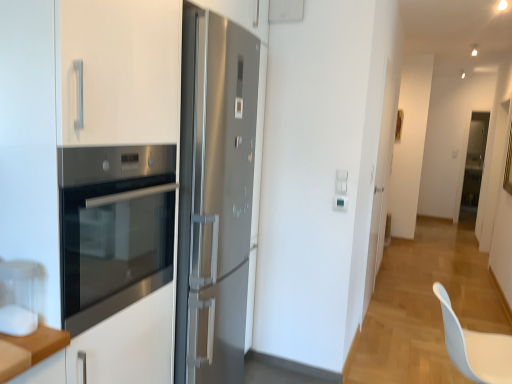
Question: Can you confirm if transparent glass door at center is bigger than stainless steel oven at left?

Choices:
 (A) no
 (B) yes

Answer: (A)

Question: From the image's perspective, is transparent glass door at center under stainless steel oven at left?

Choices:
 (A) no
 (B) yes

Answer: (A)

Question: Is transparent glass door at center oriented away from stainless steel oven at left?

Choices:
 (A) no
 (B) yes

Answer: (A)

Question: Considering the relative sizes of transparent glass door at center and stainless steel oven at left in the image provided, is transparent glass door at center wider than stainless steel oven at left?

Choices:
 (A) yes
 (B) no

Answer: (B)

Question: Considering the relative sizes of transparent glass door at center and stainless steel oven at left in the image provided, is transparent glass door at center thinner than stainless steel oven at left?

Choices:
 (A) no
 (B) yes

Answer: (B)

Question: Is the depth of transparent glass door at center less than that of stainless steel oven at left?

Choices:
 (A) yes
 (B) no

Answer: (B)

Question: Is transparent glass door at center to the left of white plastic swivel chair at lower right from the viewer's perspective?

Choices:
 (A) no
 (B) yes

Answer: (A)

Question: Considering the relative sizes of transparent glass door at center and white plastic swivel chair at lower right in the image provided, is transparent glass door at center taller than white plastic swivel chair at lower right?

Choices:
 (A) yes
 (B) no

Answer: (A)

Question: Is transparent glass door at center smaller than white plastic swivel chair at lower right?

Choices:
 (A) no
 (B) yes

Answer: (B)

Question: Can you confirm if transparent glass door at center is wider than white plastic swivel chair at lower right?

Choices:
 (A) yes
 (B) no

Answer: (B)

Question: From a real-world perspective, is transparent glass door at center on white plastic swivel chair at lower right?

Choices:
 (A) no
 (B) yes

Answer: (B)

Question: Does transparent glass door at center come in front of white plastic swivel chair at lower right?

Choices:
 (A) no
 (B) yes

Answer: (A)

Question: From the image's perspective, is white plastic swivel chair at lower right beneath white matte cabinet at left?

Choices:
 (A) no
 (B) yes

Answer: (B)